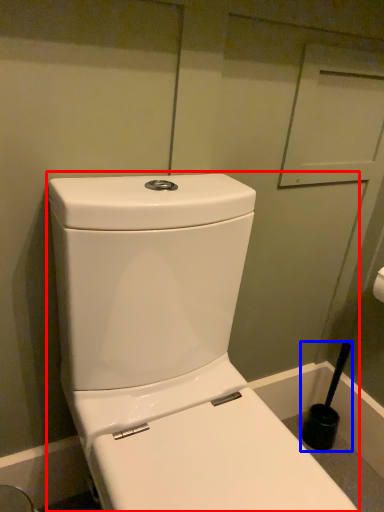
Question: Among these objects, which one is nearest to the camera, toilet (highlighted by a red box) or brush (highlighted by a blue box)?

Choices:
 (A) toilet
 (B) brush

Answer: (A)